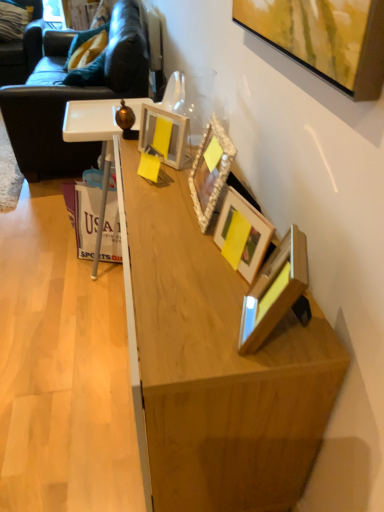
Question: Is dark brown leather swivel chair at upper left positioned before wooden picture frame at center, which ranks as the third picture frame in back-to-front order?

Choices:
 (A) yes
 (B) no

Answer: (B)

Question: Is wooden picture frame at center, which ranks as the third picture frame in back-to-front order, surrounded by dark brown leather swivel chair at upper left?

Choices:
 (A) yes
 (B) no

Answer: (B)

Question: Considering the relative sizes of dark brown leather swivel chair at upper left and wooden picture frame at center, which ranks as the third picture frame in back-to-front order, in the image provided, is dark brown leather swivel chair at upper left smaller than wooden picture frame at center, which ranks as the third picture frame in back-to-front order,?

Choices:
 (A) yes
 (B) no

Answer: (B)

Question: Does dark brown leather swivel chair at upper left have a greater height compared to wooden picture frame at center, which ranks as the third picture frame in back-to-front order?

Choices:
 (A) yes
 (B) no

Answer: (A)

Question: Is dark brown leather swivel chair at upper left not inside wooden picture frame at center, which is the 2th picture frame in front-to-back order?

Choices:
 (A) yes
 (B) no

Answer: (A)

Question: Visually, is silver textured picture frame at upper right, arranged as the third picture frame when viewed from the front, positioned to the left or to the right of wooden picture frame at center, which is the 2th picture frame in front-to-back order?

Choices:
 (A) right
 (B) left

Answer: (B)

Question: Considering the positions of point (223, 139) and point (226, 188), is point (223, 139) closer or farther from the camera than point (226, 188)?

Choices:
 (A) closer
 (B) farther

Answer: (A)

Question: Is silver textured picture frame at upper right, the second picture frame in the back-to-front sequence, in front of or behind wooden picture frame at center, which is the 2th picture frame in front-to-back order, in the image?

Choices:
 (A) behind
 (B) front

Answer: (A)

Question: In terms of size, does silver textured picture frame at upper right, the second picture frame in the back-to-front sequence, appear bigger or smaller than wooden picture frame at center, which is the 2th picture frame in front-to-back order?

Choices:
 (A) big
 (B) small

Answer: (A)

Question: Is natural wood cabinet at center inside or outside of dark brown leather swivel chair at upper left?

Choices:
 (A) inside
 (B) outside

Answer: (B)

Question: Is natural wood cabinet at center to the left or to the right of dark brown leather swivel chair at upper left in the image?

Choices:
 (A) right
 (B) left

Answer: (A)

Question: Is natural wood cabinet at center bigger or smaller than dark brown leather swivel chair at upper left?

Choices:
 (A) small
 (B) big

Answer: (A)

Question: Is natural wood cabinet at center wider or thinner than dark brown leather swivel chair at upper left?

Choices:
 (A) thin
 (B) wide

Answer: (B)

Question: Relative to dark brown leather couch at left, is wooden picture frame at center, which is the 2th picture frame in front-to-back order, in front or behind?

Choices:
 (A) front
 (B) behind

Answer: (A)

Question: From the image's perspective, relative to dark brown leather couch at left, is wooden picture frame at center, which ranks as the third picture frame in back-to-front order, above or below?

Choices:
 (A) above
 (B) below

Answer: (B)